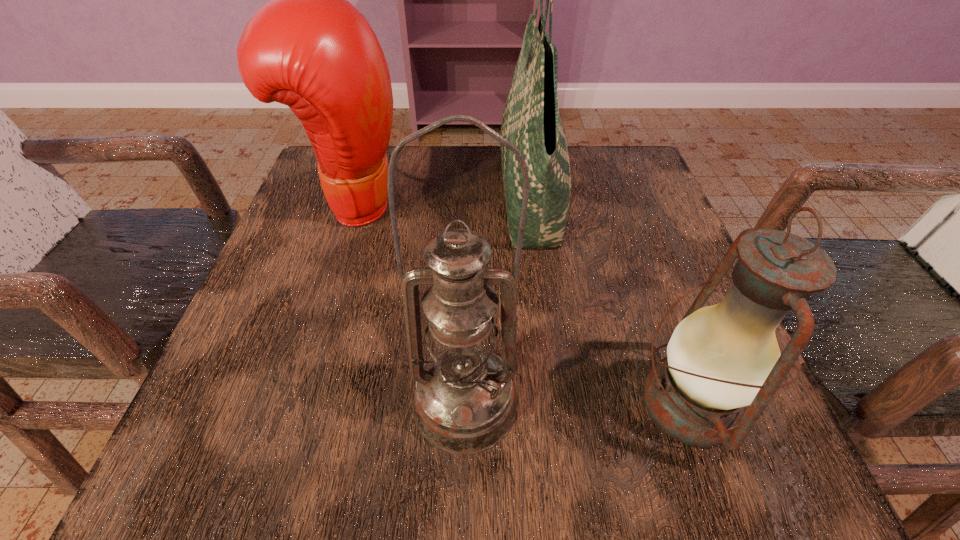
In the image, there is a desktop. In order to click on free region at the far right corner in this screenshot , I will do `click(619, 190)`.

This screenshot has height=540, width=960. In the image, there is a desktop. What are the coordinates of `free space at the near right corner` in the screenshot? It's located at (646, 438).

Locate an element on the screen. The image size is (960, 540). free space that is in between the taller oil lamp and the right oil lamp is located at coordinates (577, 403).

The image size is (960, 540). I want to click on vacant space in between the tote bag and the leftmost object, so click(441, 201).

Where is `vacant area that lies between the shorter oil lamp and the boxing glove`? vacant area that lies between the shorter oil lamp and the boxing glove is located at coordinates (521, 304).

You are a GUI agent. You are given a task and a screenshot of the screen. Output one action in this format:
    pyautogui.click(x=<x>, y=<y>)
    Task: Click on the free spot between the shorter oil lamp and the tote bag
    This screenshot has width=960, height=540.
    Given the screenshot: What is the action you would take?
    pyautogui.click(x=609, y=300)

Find the location of a particular element. This screenshot has width=960, height=540. vacant space in between the left oil lamp and the rightmost object is located at coordinates (577, 403).

Locate which object ranks third in proximity to the taller oil lamp. Please provide its 2D coordinates. Your answer should be formatted as a tuple, i.e. [(x, y)], where the tuple contains the x and y coordinates of a point satisfying the conditions above.

[(309, 48)]

This screenshot has width=960, height=540. In order to click on the third closest object to the leftmost object in this screenshot , I will do `click(721, 358)`.

At what (x,y) coordinates should I click in order to perform the action: click on free space in the image that satisfies the following two spatial constraints: 1. on the striking surface of the taller oil lamp; 2. on the left side of the boxing glove. Please return your answer as a coordinate pair (x, y). This screenshot has height=540, width=960. Looking at the image, I should click on (288, 402).